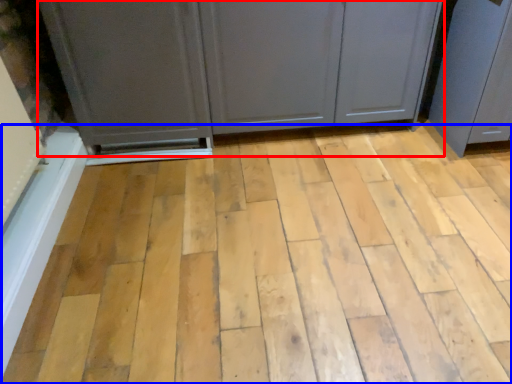
Question: Among these objects, which one is nearest to the camera, cupboard (highlighted by a red box) or plank (highlighted by a blue box)?

Choices:
 (A) cupboard
 (B) plank

Answer: (B)